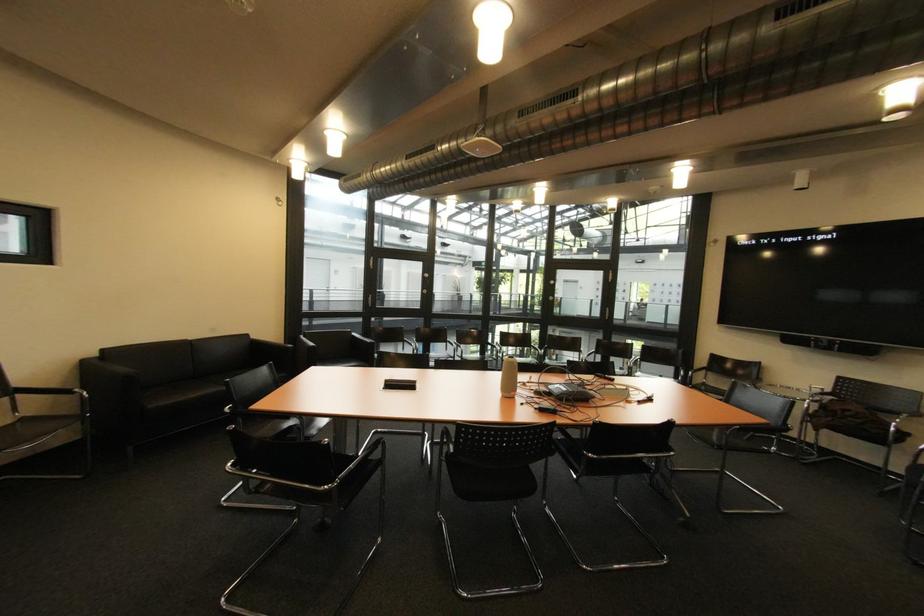
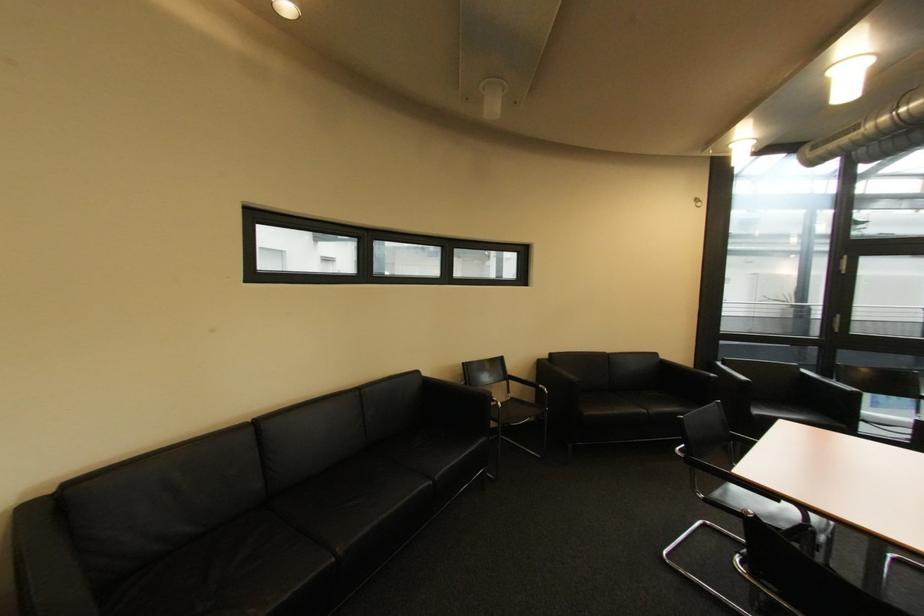
The point at (32,419) is marked in the first image. Where is the corresponding point in the second image?

(520, 400)